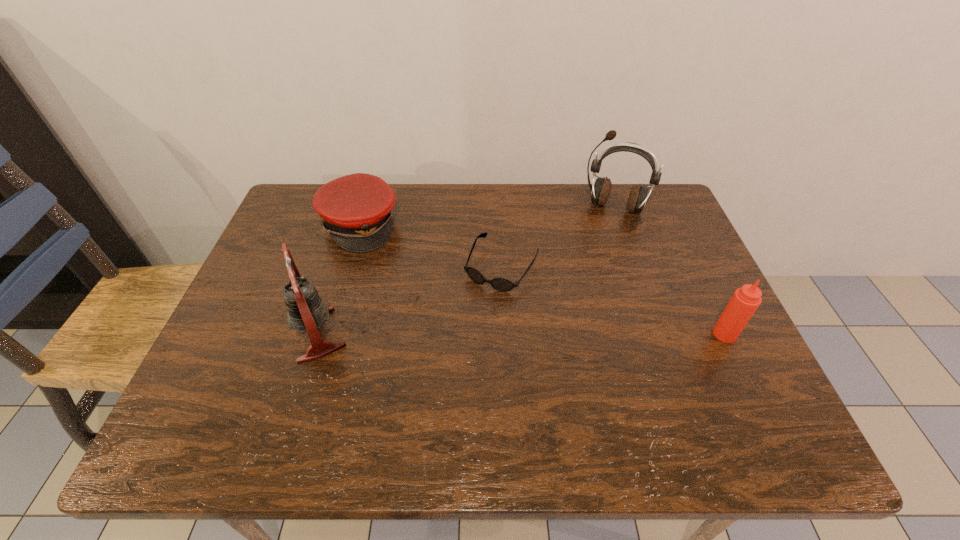
Where is `free region located 0.270m on the lenses of the shortest object`? free region located 0.270m on the lenses of the shortest object is located at coordinates (435, 377).

You are a GUI agent. You are given a task and a screenshot of the screen. Output one action in this format:
    pyautogui.click(x=<x>, y=<y>)
    Task: Click on the vacant space positioned 0.160m on the lenses of the shortest object
    Image resolution: width=960 pixels, height=540 pixels.
    Given the screenshot: What is the action you would take?
    pyautogui.click(x=458, y=339)

Identify the location of vacant space located 0.070m on the ear pads of the earphone. (603, 234).

I want to click on vacant space located 0.290m on the ear pads of the earphone, so click(x=586, y=287).

Image resolution: width=960 pixels, height=540 pixels. In order to click on blank area located on the ear pads of the earphone in this screenshot , I will do `click(578, 313)`.

You are a GUI agent. You are given a task and a screenshot of the screen. Output one action in this format:
    pyautogui.click(x=<x>, y=<y>)
    Task: Click on the vacant point located 0.330m on the front of the cap with an emblem
    The image size is (960, 540).
    Given the screenshot: What is the action you would take?
    pyautogui.click(x=457, y=315)

This screenshot has height=540, width=960. What are the coordinates of `vacant space located on the front of the cap with an emblem` in the screenshot? It's located at (442, 301).

The image size is (960, 540). In order to click on vacant area situated 0.380m on the front of the cap with an emblem in this screenshot , I will do `click(471, 327)`.

You are a GUI agent. You are given a task and a screenshot of the screen. Output one action in this format:
    pyautogui.click(x=<x>, y=<y>)
    Task: Click on the earphone at the far edge
    
    Given the screenshot: What is the action you would take?
    pyautogui.click(x=600, y=191)

The image size is (960, 540). Identify the location of cap that is at the far edge. (357, 209).